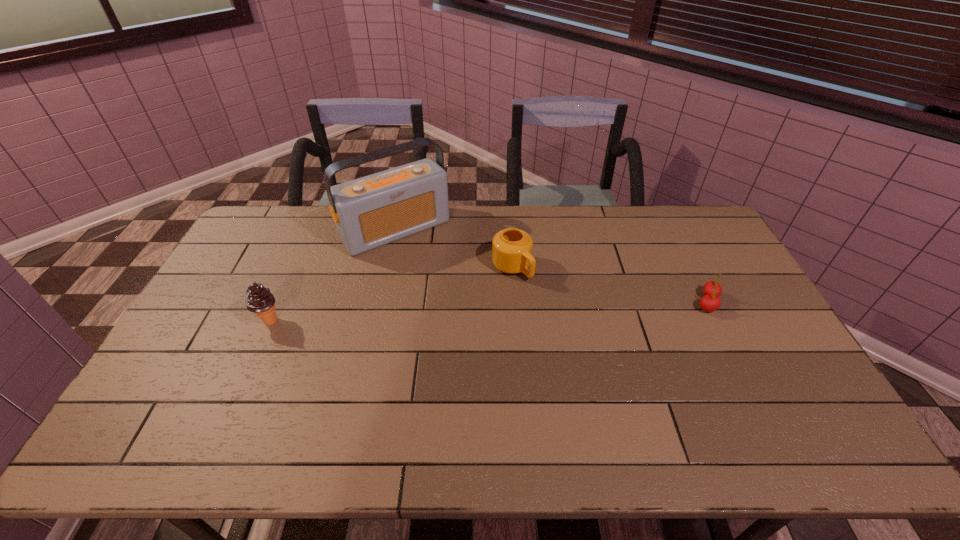
This screenshot has width=960, height=540. I want to click on free space located 0.100m on the handle side of the second object from right to left, so click(x=544, y=300).

I want to click on vacant area situated 0.070m on the handle side of the second object from right to left, so click(539, 294).

I want to click on blank space located 0.370m on the handle side of the second object from right to left, so click(x=609, y=360).

The height and width of the screenshot is (540, 960). In order to click on vacant space positioned on the front-facing side of the third object from right to left in this screenshot , I will do `click(469, 314)`.

Where is `blank space located 0.210m on the front-facing side of the third object from right to left`? This screenshot has height=540, width=960. blank space located 0.210m on the front-facing side of the third object from right to left is located at coordinates (450, 290).

Image resolution: width=960 pixels, height=540 pixels. What are the coordinates of `vacant space situated 0.370m on the front-facing side of the third object from right to left` in the screenshot? It's located at (477, 322).

This screenshot has width=960, height=540. I want to click on object that is at the far edge, so click(x=369, y=212).

Locate an element on the screen. This screenshot has width=960, height=540. object located in the right edge section of the desktop is located at coordinates point(712,290).

Locate an element on the screen. This screenshot has height=540, width=960. free space at the far edge is located at coordinates (626, 235).

Where is `free space at the near edge of the desktop`? This screenshot has width=960, height=540. free space at the near edge of the desktop is located at coordinates (444, 407).